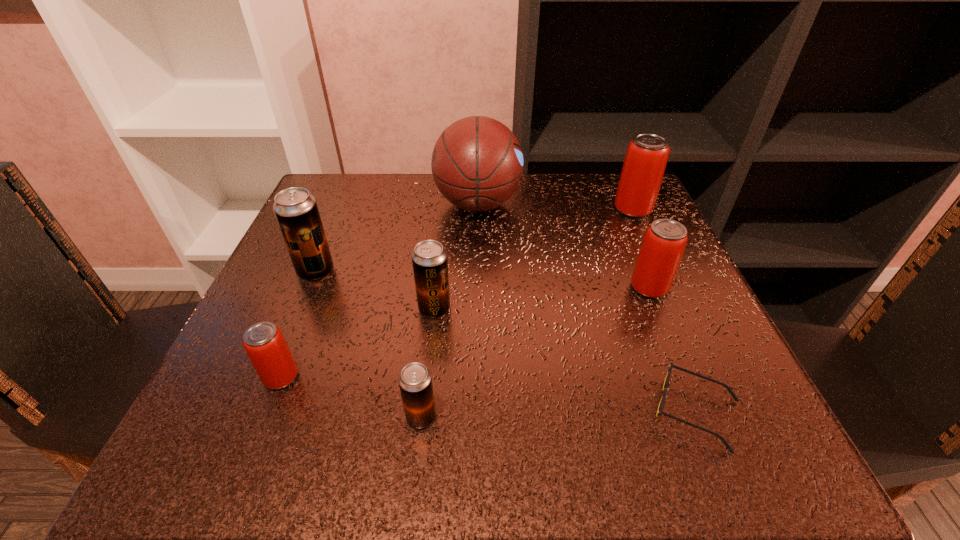
This screenshot has width=960, height=540. In order to click on basketball in this screenshot , I will do `click(477, 163)`.

In order to click on the farthest pink beer can in this screenshot , I will do `click(647, 154)`.

I want to click on the farthest beer can, so click(647, 154).

Identify the location of the farthest black beer can. Image resolution: width=960 pixels, height=540 pixels. (296, 210).

At what (x,y) coordinates should I click in order to perform the action: click on the leftmost black beer can. Please return your answer as a coordinate pair (x, y). The image size is (960, 540). Looking at the image, I should click on (296, 210).

This screenshot has height=540, width=960. I want to click on the second biggest black beer can, so click(x=429, y=259).

At what (x,y) coordinates should I click in order to perform the action: click on the second biggest pink beer can. Please return your answer as a coordinate pair (x, y). The width and height of the screenshot is (960, 540). Looking at the image, I should click on (665, 240).

The height and width of the screenshot is (540, 960). I want to click on the leftmost pink beer can, so click(x=264, y=343).

At what (x,y) coordinates should I click in order to perform the action: click on the second nearest beer can. Please return your answer as a coordinate pair (x, y). Looking at the image, I should click on (264, 343).

This screenshot has width=960, height=540. Find the location of `the nearest beer can`. the nearest beer can is located at coordinates (415, 381).